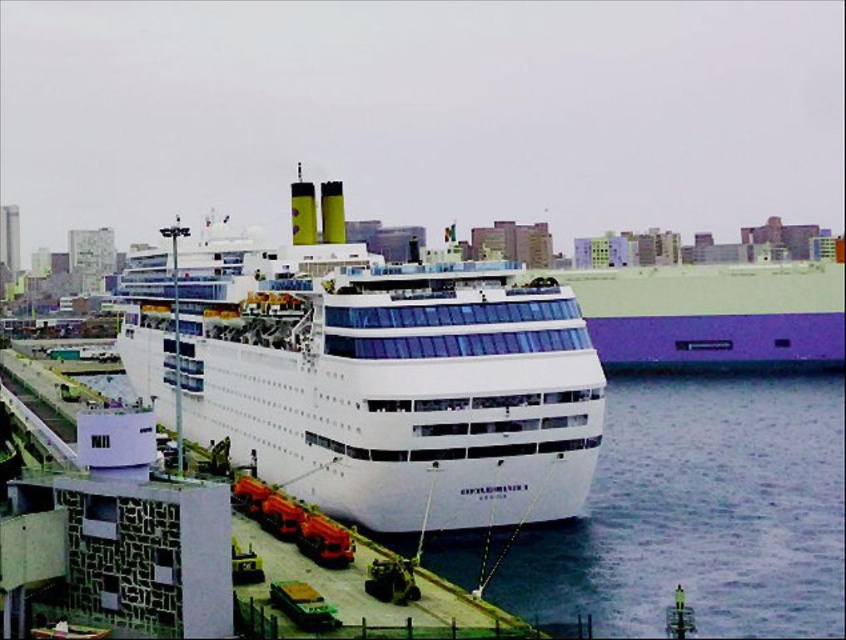
You are a port authority inspector evaluating the docking area. You need to ensure that the white glossy cruise ship at center and the clear water at lower center are properly positioned. Based on their sizes, which object occupies more space in the image?

The white glossy cruise ship at center is larger in size than the clear water at lower center, so it occupies more space in the image.

You are standing at the port and see the white glossy cruise ship at center. If you were to draw a straight line from your current position to the ship, would it pass through any of the dock equipment or cranes shown in the scene?

The white glossy cruise ship at center is positioned at coordinates point [389,378], so drawing a straight line from your current position to it might pass through the dock equipment or cranes since they are located in the foreground near the dock area.